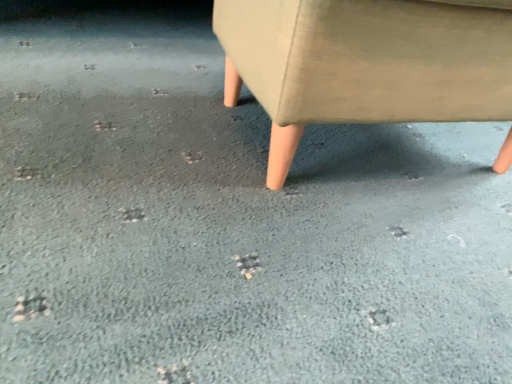
The height and width of the screenshot is (384, 512). Describe the element at coordinates (365, 63) in the screenshot. I see `matte beige fabric sofa at center` at that location.

Locate an element on the screen. The image size is (512, 384). matte beige fabric sofa at center is located at coordinates (365, 63).

Find the location of a particular element. This screenshot has width=512, height=384. matte beige fabric sofa at center is located at coordinates (365, 63).